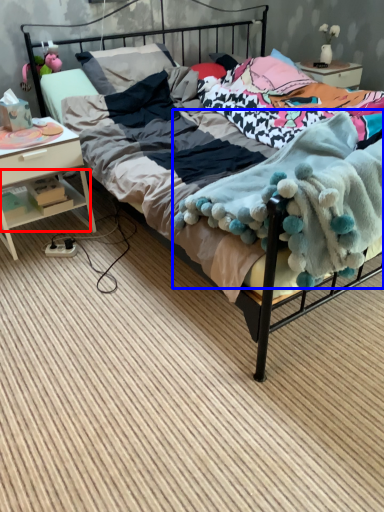
Question: Which object is closer to the camera taking this photo, shelf (highlighted by a red box) or blanket (highlighted by a blue box)?

Choices:
 (A) shelf
 (B) blanket

Answer: (B)